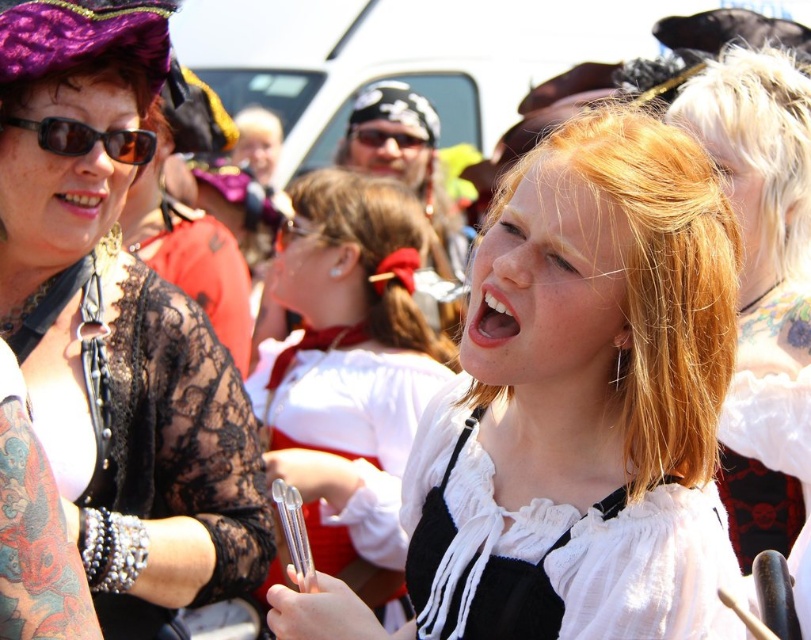
Question: Where is white cotton blouse at center located in relation to clear plastic goggles at center in the image?

Choices:
 (A) above
 (B) below

Answer: (B)

Question: Which object is closer to the camera taking this photo?

Choices:
 (A) white cotton blouse at center
 (B) pink glossy lips at center
 (C) lace fabric blouse at upper left

Answer: (A)

Question: Which point appears closest to the camera in this image?

Choices:
 (A) (279, 237)
 (B) (155, 140)
 (C) (501, 214)
 (D) (406, 145)

Answer: (C)

Question: Is pink glossy lips at center bigger than white glossy teeth at center?

Choices:
 (A) no
 (B) yes

Answer: (B)

Question: Which point is farther to the camera?

Choices:
 (A) pink glossy lips at center
 (B) white glossy teeth at center
 (C) white cotton blouse at center
 (D) black plastic goggles at center

Answer: (D)

Question: Where is matte black sunglasses at upper left located in relation to black plastic goggles at center in the image?

Choices:
 (A) below
 (B) above

Answer: (A)